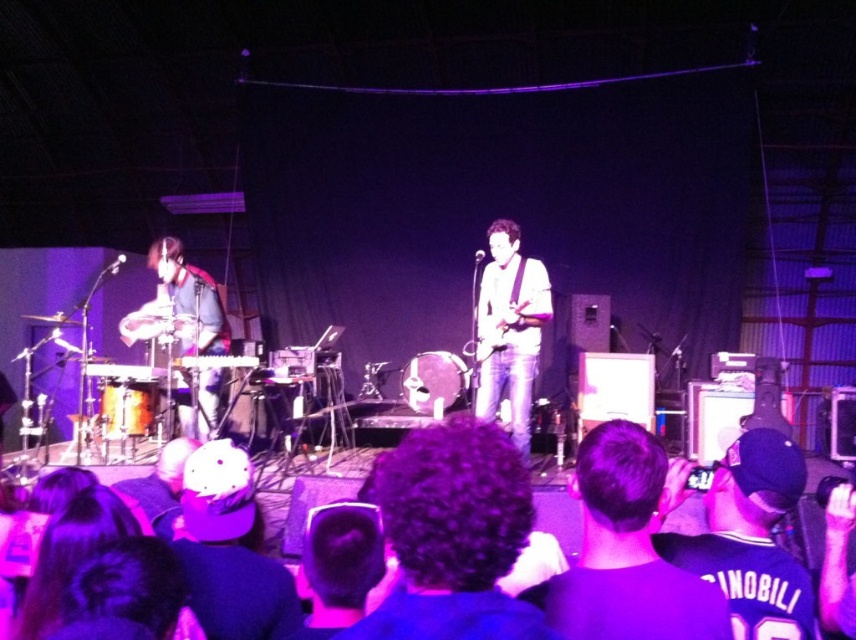
Is matte black drum set at left smaller than brushed metal drum at left?

No, matte black drum set at left is not smaller than brushed metal drum at left.

Is the position of matte black drum set at left less distant than that of brushed metal drum at left?

That is False.

I want to click on matte black drum set at left, so click(189, 300).

Where is `matte black drum set at left`? matte black drum set at left is located at coordinates (189, 300).

Is point (513, 433) positioned before point (163, 310)?

Yes.

Between point (516, 317) and point (165, 321), which one is positioned in front?

Point (516, 317) is in front.

Which is in front, point (492, 310) or point (150, 305)?

Point (492, 310) is more forward.

This screenshot has height=640, width=856. In order to click on white matte guitar at center in this screenshot , I will do `click(509, 328)`.

Can you confirm if matte black drum set at left is positioned below matte black guitar at center?

Indeed, matte black drum set at left is positioned under matte black guitar at center.

Who is positioned more to the right, matte black drum set at left or matte black guitar at center?

matte black guitar at center

This screenshot has width=856, height=640. Find the location of `matte black drum set at left`. matte black drum set at left is located at coordinates (189, 300).

Where is `matte black drum set at left`? The height and width of the screenshot is (640, 856). matte black drum set at left is located at coordinates (189, 300).